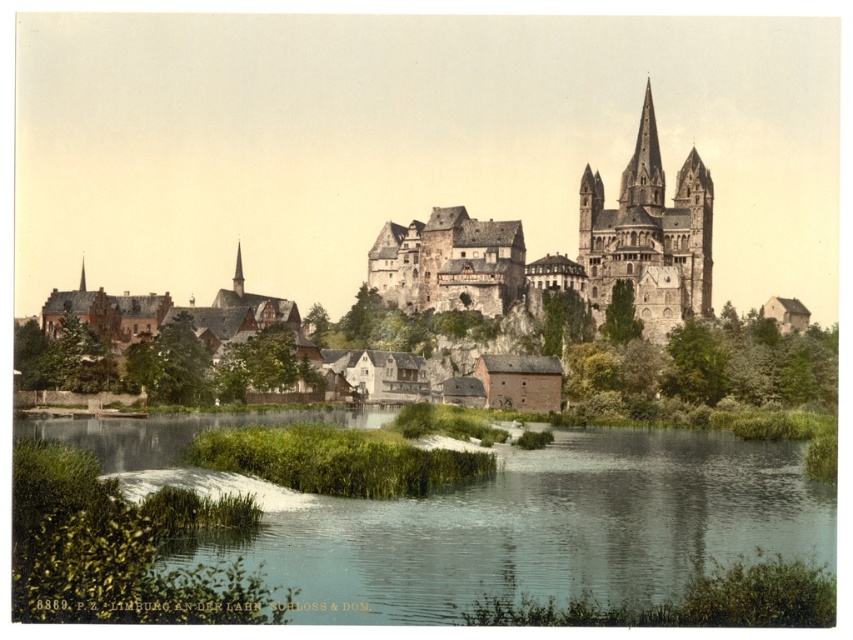
You are standing in front of the cathedral in Limburg an der Lahn and want to take a photo. You notice two points marked on the ground in front of you. The first point is at coordinate point (677, 176) and the second point is at coordinate point (82, 273). If you want to get a closer shot of the cathedral, which point should you stand on?

You should stand on point (677, 176) because it is closer to the viewer than point (82, 273), allowing for a closer shot of the cathedral.

You are standing in the town square of Limburg an der Lahn and want to take a photo of the green grassy river at lower center and the smooth stone spire at upper center. Which object will appear larger in your photo?

The green grassy river at lower center will appear larger in the photo because it is closer to the viewer than the smooth stone spire at upper center.

You are a drone operator tasked with capturing aerial footage of the cathedral and castle in Limburg an der Lahn. Your drone has a maximum flight range of 50 meters from its starting position. If you position yourself between the smooth stone spire at upper center and the smooth gray steeple at upper left, will your drone be able to film both structures without exceeding its range?

The smooth stone spire at upper center is 50.33 meters from the smooth gray steeple at upper left. Since the drone has a maximum range of 50 meters, it cannot film both structures without exceeding its range.